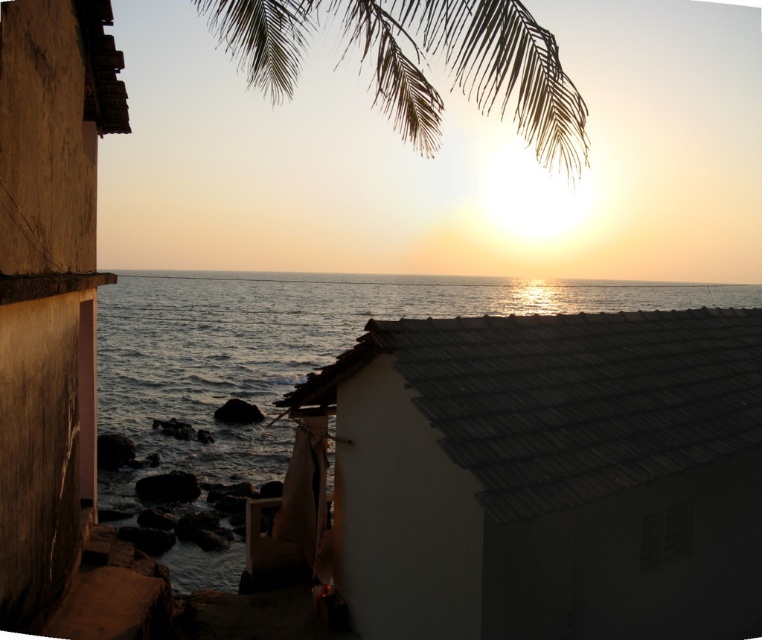
Question: Among these objects, which one is nearest to the camera?

Choices:
 (A) silvery textured leaves at upper center
 (B) blue water at center

Answer: (A)

Question: Does blue water at center have a greater width compared to silvery textured leaves at upper center?

Choices:
 (A) yes
 (B) no

Answer: (A)

Question: Can you confirm if blue water at center is positioned to the left of silvery textured leaves at upper center?

Choices:
 (A) yes
 (B) no

Answer: (B)

Question: Does smooth brown wall at left have a smaller size compared to silvery textured leaves at upper center?

Choices:
 (A) yes
 (B) no

Answer: (A)

Question: Which object is farther from the camera taking this photo?

Choices:
 (A) smooth brown wall at left
 (B) blue water at center

Answer: (A)

Question: Which of the following is the closest to the observer?

Choices:
 (A) smooth brown wall at left
 (B) silvery textured leaves at upper center
 (C) blue water at center

Answer: (B)